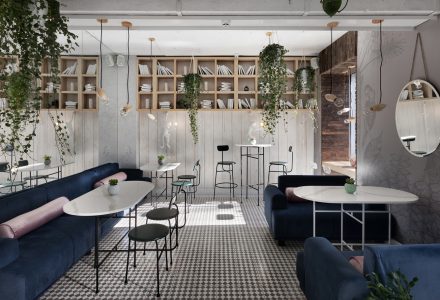
At what (x,y) coordinates should I click in order to perform the action: click on table. Please return your answer as a coordinate pair (x, y). Looking at the image, I should click on (165, 165), (121, 194), (258, 144), (311, 189).